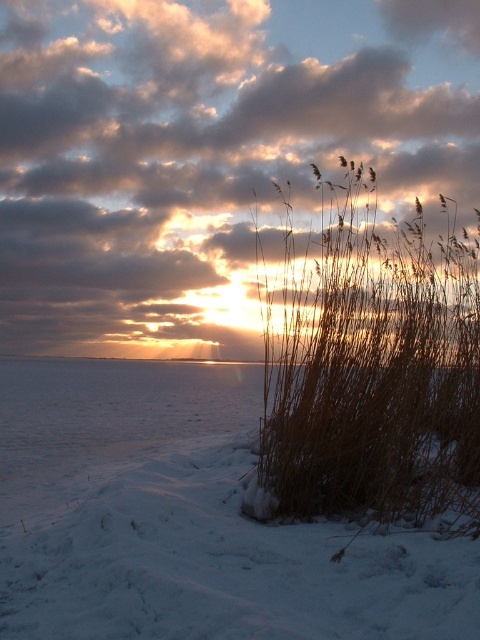
You are standing in the winter landscape and want to walk from the point at coordinates point (98, 426) to the point at coordinates point (330, 490). Which direction should you face to move towards the latter point?

You should face towards the lower right direction because point (330, 490) is further away from the viewer compared to point (98, 426), meaning it is located lower and to the right in the image.